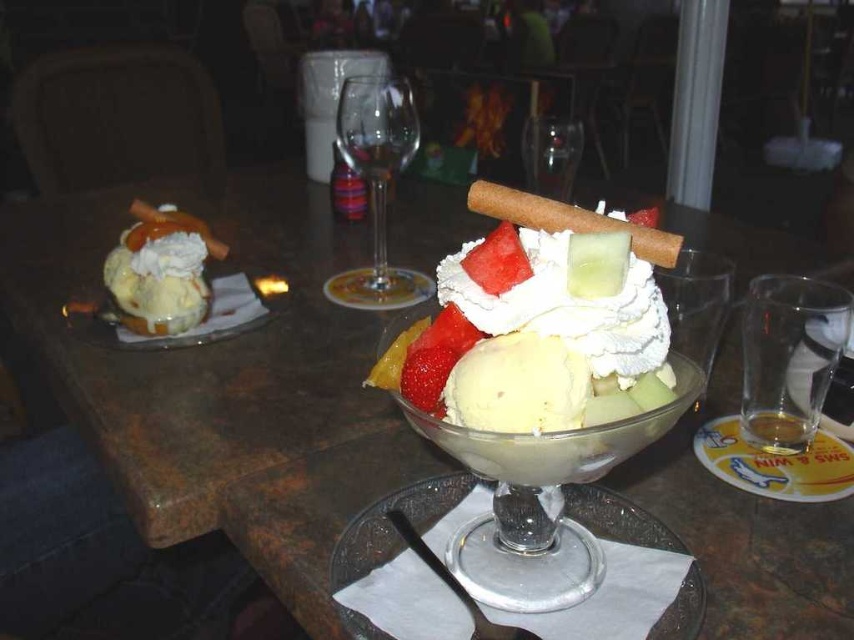
Question: Can you confirm if white paper plate at left is positioned to the right of red matte strawberry at center?

Choices:
 (A) no
 (B) yes

Answer: (A)

Question: Which point is farther from the camera taking this photo?

Choices:
 (A) (366, 467)
 (B) (88, 305)

Answer: (B)

Question: Estimate the real-world distances between objects in this image. Which object is farther from the matte white ice cream sundae at left?

Choices:
 (A) yellow matte fruit at center
 (B) white paper plate at left
 (C) red matte strawberry at center

Answer: (C)

Question: From the image, what is the correct spatial relationship of transparent glass wine glass at center in relation to matte white ice cream sundae at left?

Choices:
 (A) right
 (B) left

Answer: (A)

Question: Considering the real-world distances, which object is farthest from the transparent glass wine glass at center?

Choices:
 (A) yellow matte fruit at center
 (B) white paper plate at left

Answer: (A)

Question: Considering the relative positions of transparent glass wine glass at center and matte white ice cream sundae at left in the image provided, where is transparent glass wine glass at center located with respect to matte white ice cream sundae at left?

Choices:
 (A) below
 (B) above

Answer: (B)